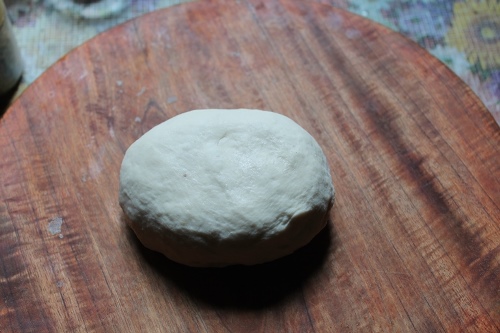
Find the location of a particular element. flower jar is located at coordinates (11, 56).